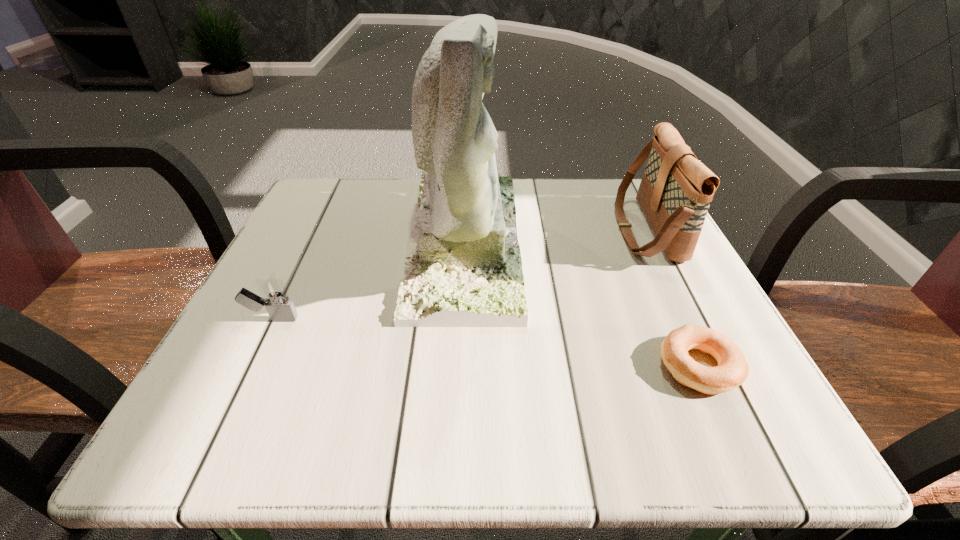
Locate an element on the screen. The width and height of the screenshot is (960, 540). vacant area that lies between the third shortest object and the sculpture is located at coordinates (555, 235).

You are a GUI agent. You are given a task and a screenshot of the screen. Output one action in this format:
    pyautogui.click(x=<x>, y=<y>)
    Task: Click on the unoccupied position between the bagel and the shoulder bag
    The image size is (960, 540).
    Given the screenshot: What is the action you would take?
    pyautogui.click(x=672, y=298)

I want to click on vacant area between the tallest object and the third shortest object, so click(x=555, y=235).

You are a GUI agent. You are given a task and a screenshot of the screen. Output one action in this format:
    pyautogui.click(x=<x>, y=<y>)
    Task: Click on the vacant point located between the shortest object and the third shortest object
    The image size is (960, 540).
    Given the screenshot: What is the action you would take?
    pyautogui.click(x=672, y=298)

At what (x,y) coordinates should I click in order to perform the action: click on free spot between the sculpture and the bagel. Please return your answer as a coordinate pair (x, y). The height and width of the screenshot is (540, 960). Looking at the image, I should click on (581, 303).

You are a GUI agent. You are given a task and a screenshot of the screen. Output one action in this format:
    pyautogui.click(x=<x>, y=<y>)
    Task: Click on the closest object to the igniter
    
    Given the screenshot: What is the action you would take?
    pyautogui.click(x=463, y=269)

This screenshot has width=960, height=540. What are the coordinates of `object identified as the third closest to the sculpture` in the screenshot? It's located at (676, 189).

The width and height of the screenshot is (960, 540). In order to click on vacant area in the image that satisfies the following two spatial constraints: 1. on the back side of the bagel; 2. on the base of the second object from left to right in this screenshot , I will do `click(640, 240)`.

Identify the location of blank area in the image that satisfies the following two spatial constraints: 1. on the base of the third object from right to left; 2. on the left side of the nearest object. [x=459, y=366].

At what (x,y) coordinates should I click in order to perform the action: click on free location that satisfies the following two spatial constraints: 1. on the base of the tallest object; 2. on the left side of the shortest object. Please return your answer as a coordinate pair (x, y). The height and width of the screenshot is (540, 960). Looking at the image, I should click on (459, 366).